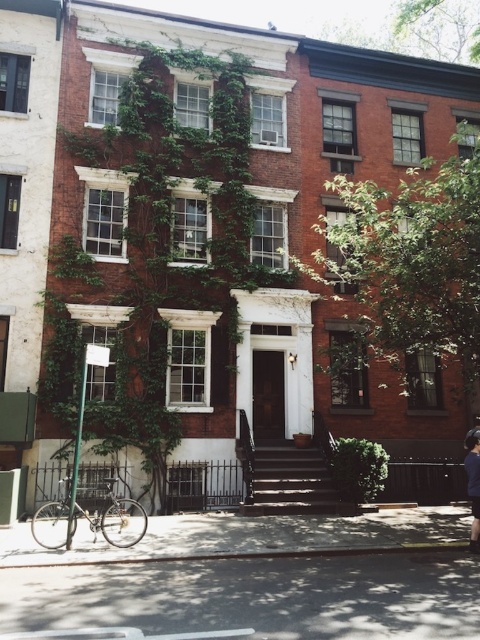
Does dark brown wooden stairs at center have a smaller size compared to dark blue fabric jacket at center?

No, dark brown wooden stairs at center is not smaller than dark blue fabric jacket at center.

Is point (291, 504) closer to camera compared to point (466, 456)?

That is False.

This screenshot has height=640, width=480. In order to click on dark brown wooden stairs at center in this screenshot , I will do `click(290, 481)`.

Is point (134, 397) positioned after point (477, 509)?

Yes.

Consider the image. Who is shorter, green ivy at center or dark blue fabric jacket at center?

green ivy at center is shorter.

Is point (132, 292) farther from camera compared to point (469, 547)?

Yes, it is behind point (469, 547).

You are a GUI agent. You are given a task and a screenshot of the screen. Output one action in this format:
    pyautogui.click(x=<x>, y=<y>)
    Task: Click on the green ivy at center
    The image size is (480, 640).
    Given the screenshot: What is the action you would take?
    pyautogui.click(x=154, y=253)

Between green ivy at center and dark brown wooden stairs at center, which one has less height?

green ivy at center

Is green ivy at center to the right of dark brown wooden stairs at center from the viewer's perspective?

In fact, green ivy at center is to the left of dark brown wooden stairs at center.

Which is behind, point (153, 252) or point (299, 484)?

The point (153, 252) is more distant.

The height and width of the screenshot is (640, 480). Find the location of `green ivy at center`. green ivy at center is located at coordinates (154, 253).